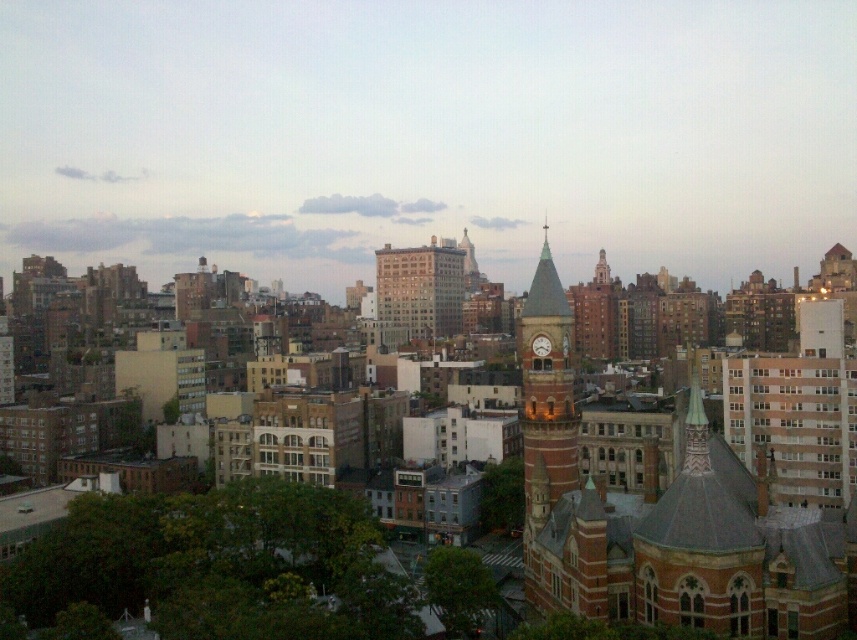
Question: Which point appears farthest from the camera in this image?

Choices:
 (A) (754, 634)
 (B) (703, 428)
 (C) (542, 344)
 (D) (376, 292)

Answer: (D)

Question: Among these objects, which one is farthest from the camera?

Choices:
 (A) matte brick clock tower at center
 (B) green marble spire at center-right
 (C) brick clock tower at center
 (D) green copper dome at center

Answer: (A)

Question: Where is brick clock tower at center located in relation to matte brick building at center in the image?

Choices:
 (A) above
 (B) below

Answer: (B)

Question: Based on their relative distances, which object is farther from the green copper dome at center?

Choices:
 (A) matte brick clock tower at center
 (B) matte brick building at center
 (C) green marble spire at center-right

Answer: (B)

Question: Is brick clock tower at center positioned at the back of green marble spire at center-right?

Choices:
 (A) yes
 (B) no

Answer: (A)

Question: Can you confirm if green copper dome at center is positioned to the left of brick clock tower at center?

Choices:
 (A) yes
 (B) no

Answer: (B)